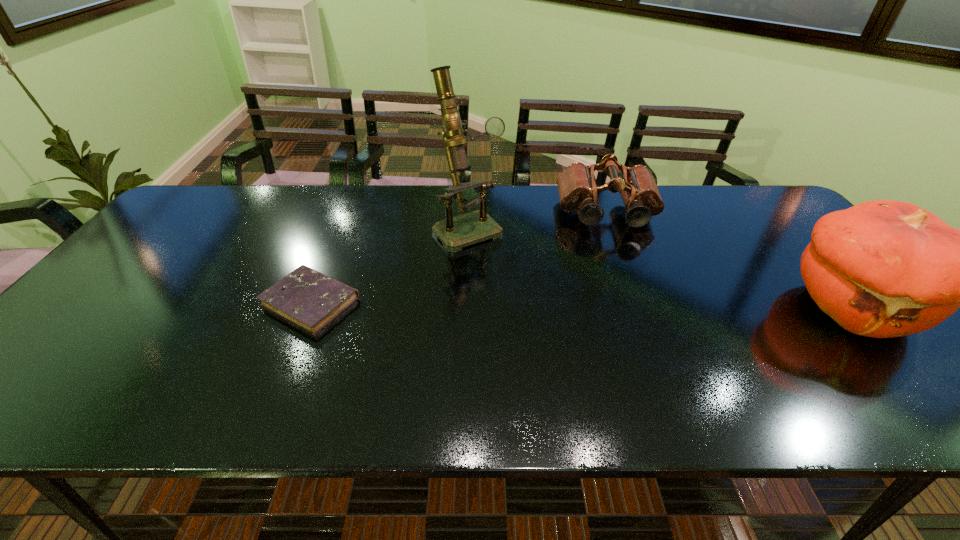
At what (x,y) coordinates should I click in order to perform the action: click on vacant space located through the eyepieces of the second shortest object. Please return your answer as a coordinate pair (x, y). The image size is (960, 540). Looking at the image, I should click on (624, 289).

Locate an element on the screen. This screenshot has height=540, width=960. vacant space located through the eyepieces of the second shortest object is located at coordinates (623, 287).

Locate an element on the screen. The height and width of the screenshot is (540, 960). vacant space situated through the eyepieces of the second shortest object is located at coordinates (622, 281).

This screenshot has width=960, height=540. I want to click on microscope present at the far edge, so click(x=457, y=232).

Identify the location of binoculars that is at the far edge. The width and height of the screenshot is (960, 540). (577, 189).

This screenshot has height=540, width=960. In the image, there is a desktop. Find the location of `vacant space at the far edge`. vacant space at the far edge is located at coordinates (500, 212).

Where is `free space at the near edge`? The width and height of the screenshot is (960, 540). free space at the near edge is located at coordinates (442, 372).

The height and width of the screenshot is (540, 960). I want to click on vacant space at the left edge of the desktop, so click(126, 323).

At what (x,y) coordinates should I click in order to perform the action: click on free space at the right edge of the desktop. Please return your answer as a coordinate pair (x, y). Looking at the image, I should click on (801, 253).

At what (x,y) coordinates should I click in order to perform the action: click on free space between the microscope and the third object from left to right. Please return your answer as a coordinate pair (x, y). Looking at the image, I should click on (538, 221).